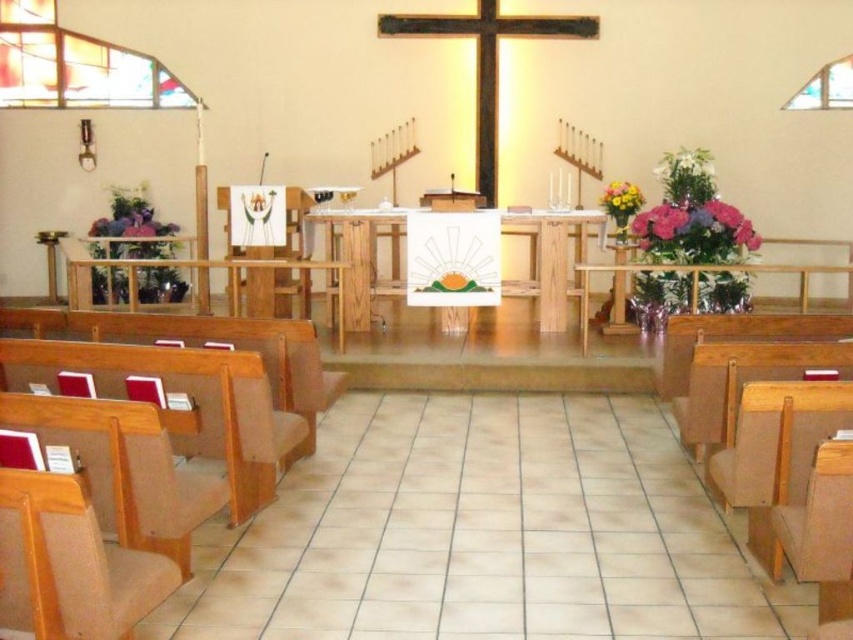
Image resolution: width=853 pixels, height=640 pixels. What do you see at coordinates (186, 403) in the screenshot? I see `light brown wood church bench at lower left` at bounding box center [186, 403].

Can you confirm if light brown wood church bench at lower left is smaller than wooden cross at center?

No, light brown wood church bench at lower left is not smaller than wooden cross at center.

The width and height of the screenshot is (853, 640). What do you see at coordinates (186, 403) in the screenshot? I see `light brown wood church bench at lower left` at bounding box center [186, 403].

Image resolution: width=853 pixels, height=640 pixels. I want to click on light brown wood church bench at lower left, so click(186, 403).

Which is above, light brown wood church bench at lower left or brown leather chair at right?

light brown wood church bench at lower left is higher up.

Consider the image. Who is positioned more to the right, light brown wood church bench at lower left or brown leather chair at right?

From the viewer's perspective, brown leather chair at right appears more on the right side.

At what (x,y) coordinates should I click in order to perform the action: click on light brown wood church bench at lower left. Please return your answer as a coordinate pair (x, y). Looking at the image, I should click on (186, 403).

Can you confirm if brown leather chair at right is smaller than wooden cross at center?

No, brown leather chair at right is not smaller than wooden cross at center.

Is brown leather chair at right below wooden cross at center?

Yes.

The width and height of the screenshot is (853, 640). Find the location of `brown leather chair at right`. brown leather chair at right is located at coordinates (758, 404).